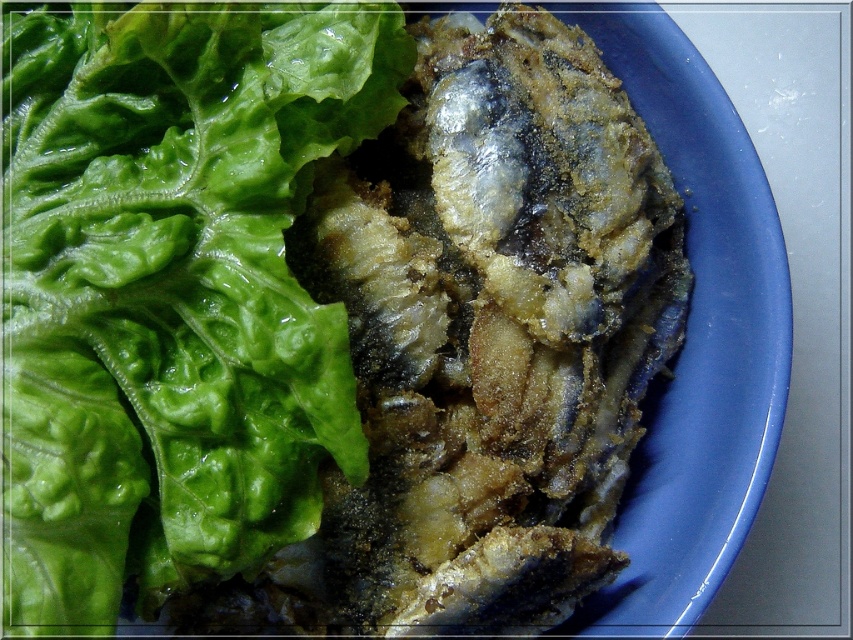
Question: Which of the following is the farthest from the observer?

Choices:
 (A) green leafy at upper left
 (B) fried golden-brown fish at center

Answer: (B)

Question: Which point is farther to the camera?

Choices:
 (A) click(496, 444)
 (B) click(88, 508)

Answer: (A)

Question: Is green leafy at upper left to the right of fried golden-brown fish at center from the viewer's perspective?

Choices:
 (A) yes
 (B) no

Answer: (B)

Question: Can you confirm if green leafy at upper left is wider than fried golden-brown fish at center?

Choices:
 (A) yes
 (B) no

Answer: (B)

Question: Which point is farther from the camera taking this photo?

Choices:
 (A) (606, 177)
 (B) (61, 145)

Answer: (A)

Question: In this image, where is green leafy at upper left located relative to fried golden-brown fish at center?

Choices:
 (A) right
 (B) left

Answer: (B)